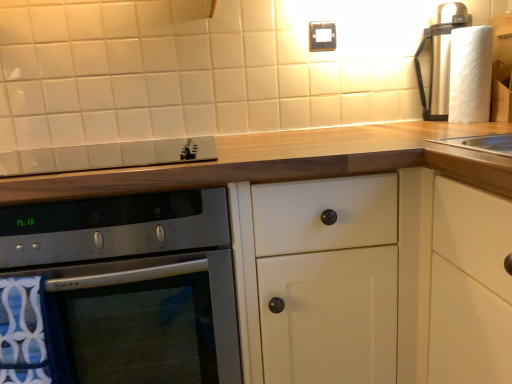
Question: Is the position of satin silver gas stove at upper center less distant than that of satin silver oven at lower left?

Choices:
 (A) yes
 (B) no

Answer: (B)

Question: Is satin silver gas stove at upper center looking in the opposite direction of satin silver oven at lower left?

Choices:
 (A) no
 (B) yes

Answer: (A)

Question: Can you confirm if satin silver gas stove at upper center is wider than satin silver oven at lower left?

Choices:
 (A) yes
 (B) no

Answer: (B)

Question: Is satin silver gas stove at upper center thinner than satin silver oven at lower left?

Choices:
 (A) yes
 (B) no

Answer: (A)

Question: Does satin silver gas stove at upper center lie behind satin silver oven at lower left?

Choices:
 (A) no
 (B) yes

Answer: (B)

Question: Looking at their shapes, would you say white matte cabinet at center is wider or thinner than white textured paper towel at upper right?

Choices:
 (A) thin
 (B) wide

Answer: (B)

Question: Considering the positions of white matte cabinet at center and white textured paper towel at upper right in the image, is white matte cabinet at center bigger or smaller than white textured paper towel at upper right?

Choices:
 (A) small
 (B) big

Answer: (B)

Question: Is white matte cabinet at center taller or shorter than white textured paper towel at upper right?

Choices:
 (A) short
 (B) tall

Answer: (B)

Question: From the image's perspective, is white matte cabinet at center positioned above or below white textured paper towel at upper right?

Choices:
 (A) above
 (B) below

Answer: (B)

Question: From a real-world perspective, is gold metallic electric outlet at upper center physically located above or below satin silver gas stove at upper center?

Choices:
 (A) below
 (B) above

Answer: (B)

Question: Is gold metallic electric outlet at upper center bigger or smaller than satin silver gas stove at upper center?

Choices:
 (A) small
 (B) big

Answer: (A)

Question: From the image's perspective, relative to satin silver gas stove at upper center, is gold metallic electric outlet at upper center above or below?

Choices:
 (A) below
 (B) above

Answer: (B)

Question: Visually, is gold metallic electric outlet at upper center positioned to the left or to the right of satin silver gas stove at upper center?

Choices:
 (A) left
 (B) right

Answer: (B)

Question: Do you think white matte cabinet at center is within satin silver gas stove at upper center, or outside of it?

Choices:
 (A) outside
 (B) inside

Answer: (A)

Question: Considering their positions, is white matte cabinet at center located in front of or behind satin silver gas stove at upper center?

Choices:
 (A) front
 (B) behind

Answer: (A)